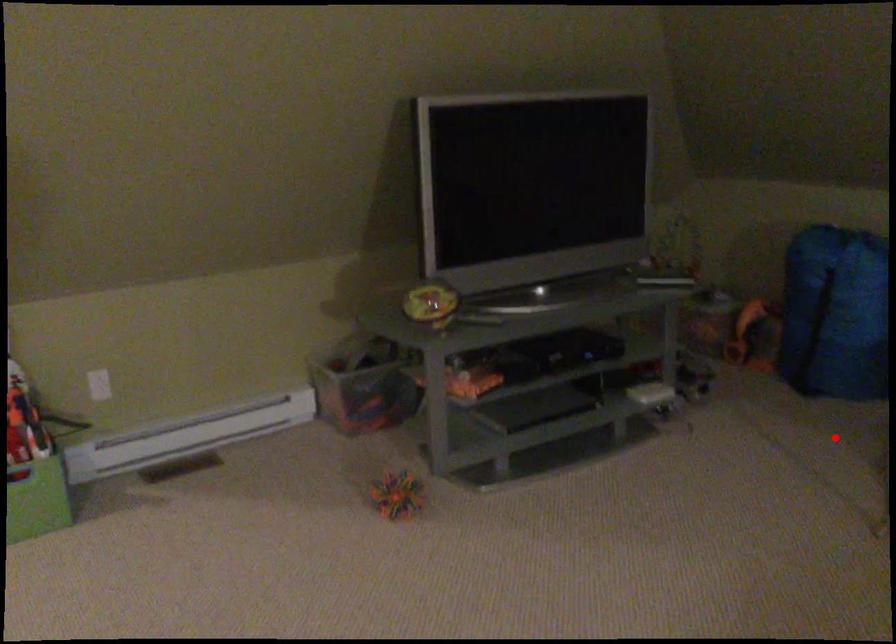
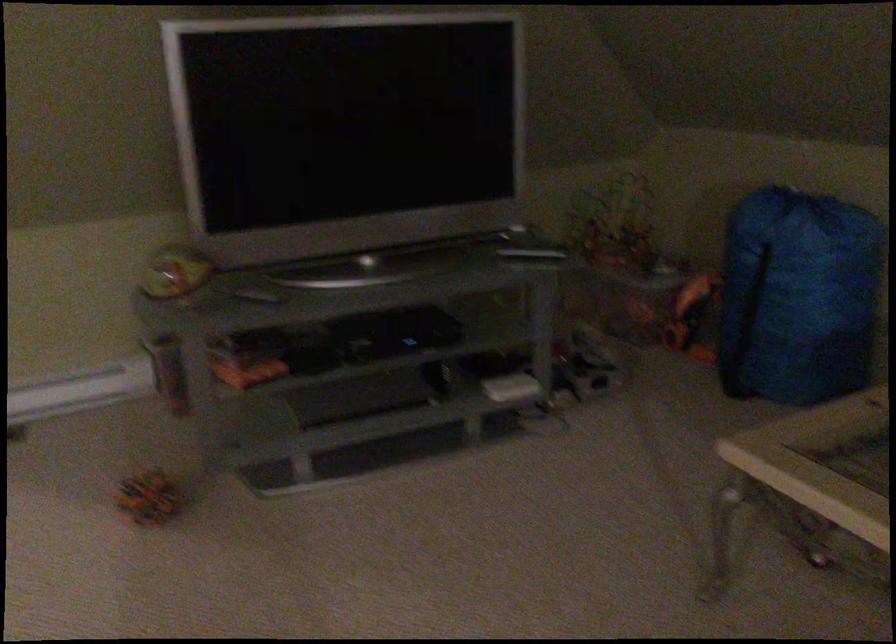
Question: I am providing you with two images of the same scene from different viewpoints. A red point is marked on the first image. Can you still see the location of the red point in image 2?

Choices:
 (A) Yes
 (B) No

Answer: (B)